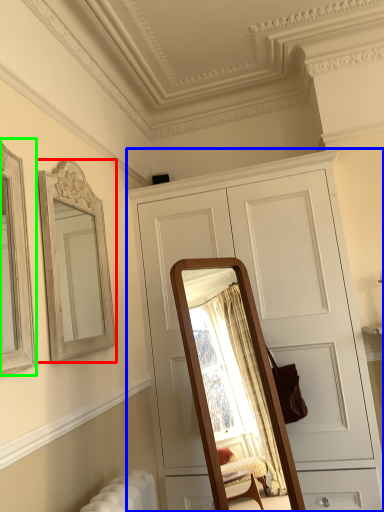
Question: Which object is the farthest from mirror (highlighted by a red box)? Choose among these: cabinetry (highlighted by a blue box) or picture frame (highlighted by a green box).

Choices:
 (A) cabinetry
 (B) picture frame

Answer: (A)